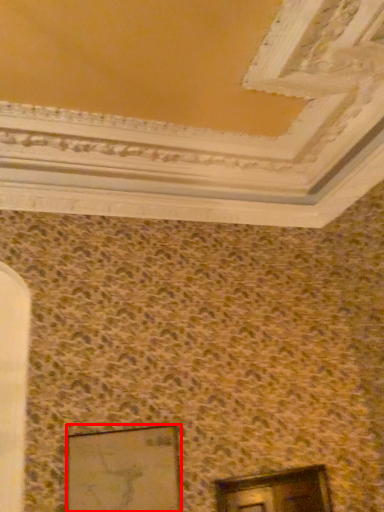
Question: Considering the relative positions of picture frame (annotated by the red box) and window in the image provided, where is picture frame (annotated by the red box) located with respect to the staircase?

Choices:
 (A) right
 (B) left

Answer: (B)